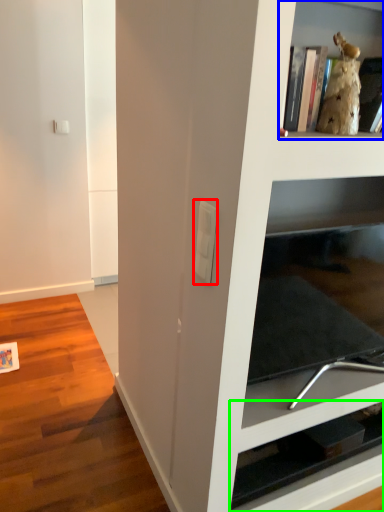
Question: Which object is the farthest from light switch (highlighted by a red box)? Choose among these: shelf (highlighted by a blue box) or shelf (highlighted by a green box).

Choices:
 (A) shelf
 (B) shelf

Answer: (B)